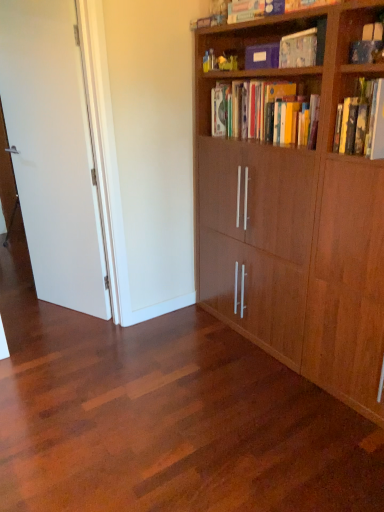
I want to click on free space to the left of white matte door at left, so click(x=39, y=309).